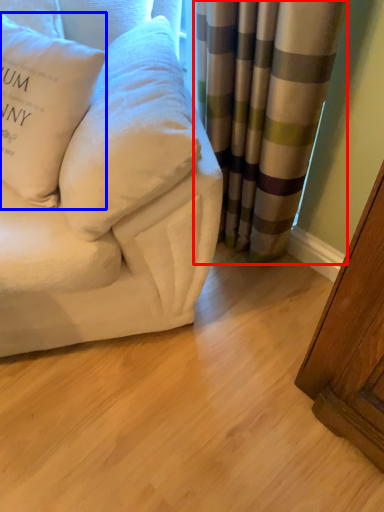
Question: Which object appears closest to the camera in this image, curtain (highlighted by a red box) or pillow (highlighted by a blue box)?

Choices:
 (A) curtain
 (B) pillow

Answer: (B)